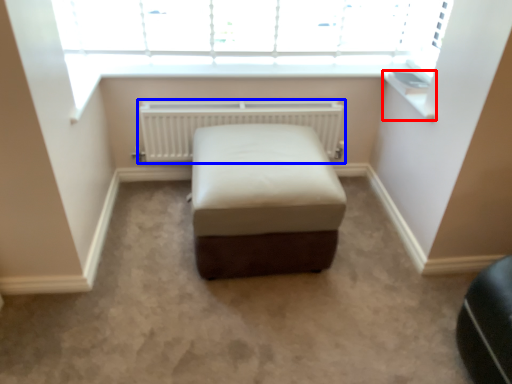
Question: Which object is further to the camera taking this photo, window sill (highlighted by a red box) or radiator (highlighted by a blue box)?

Choices:
 (A) window sill
 (B) radiator

Answer: (B)